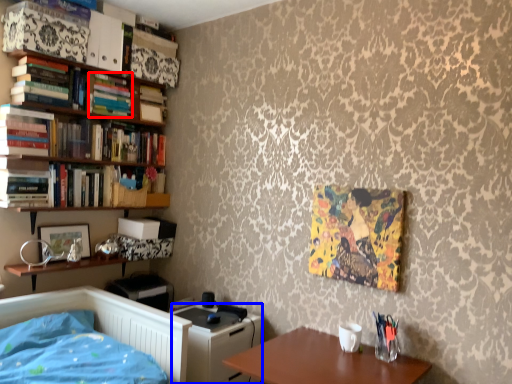
Question: Which point is closer to the camera, book (highlighted by a red box) or file cabinet (highlighted by a blue box)?

Choices:
 (A) book
 (B) file cabinet

Answer: (B)